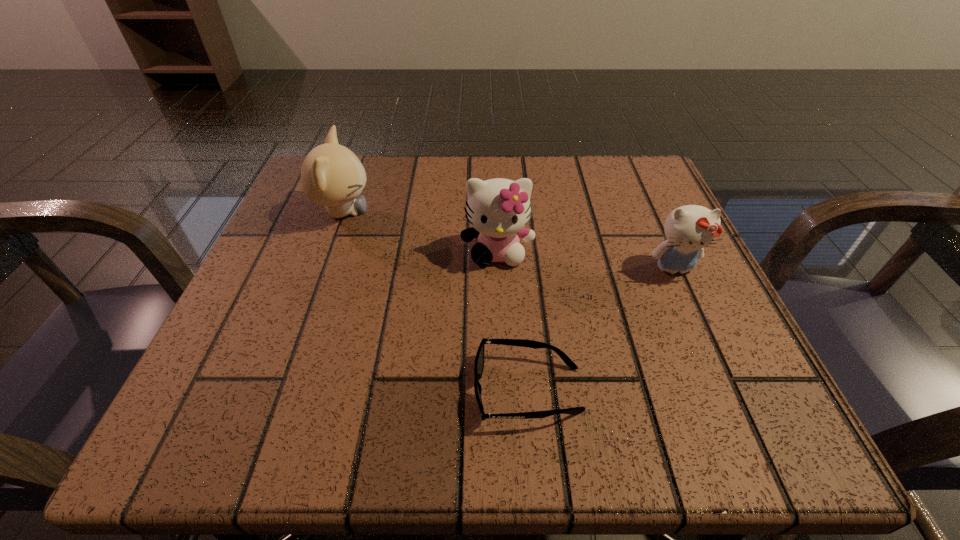
At what (x,y) coordinates should I click in order to perform the action: click on free space located 0.310m on the front-facing side of the sunglasses. Please return your answer as a coordinate pair (x, y). The width and height of the screenshot is (960, 540). Looking at the image, I should click on (239, 389).

Identify the location of vacant region located 0.200m on the front-facing side of the sunglasses. [x=323, y=389].

I want to click on free space located 0.120m on the front-facing side of the sunglasses, so click(383, 389).

Locate an element on the screen. The width and height of the screenshot is (960, 540). object situated at the far edge is located at coordinates (332, 175).

At what (x,y) coordinates should I click in order to perform the action: click on object situated at the near edge. Please return your answer as a coordinate pair (x, y). Looking at the image, I should click on (479, 359).

At what (x,y) coordinates should I click in order to perform the action: click on object that is at the left edge. Please return your answer as a coordinate pair (x, y). Image resolution: width=960 pixels, height=540 pixels. Looking at the image, I should click on (332, 175).

Where is `object that is at the right edge`? The image size is (960, 540). object that is at the right edge is located at coordinates (688, 229).

Locate an element on the screen. object present at the far left corner is located at coordinates (332, 175).

Where is `vacant space at the far edge`? This screenshot has height=540, width=960. vacant space at the far edge is located at coordinates (489, 171).

The image size is (960, 540). In the image, there is a desktop. Find the location of `blank space at the near edge`. blank space at the near edge is located at coordinates (410, 420).